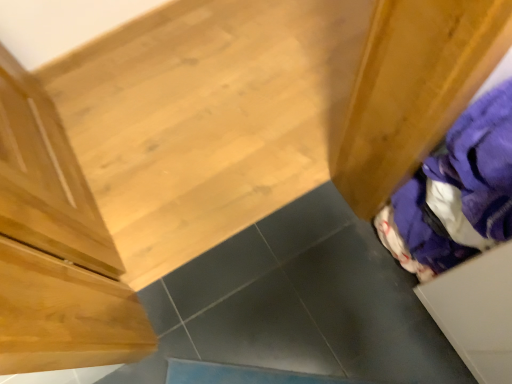
Locate an element on the screen. white matte drawer at lower right is located at coordinates (476, 312).

Describe the element at coordinates (476, 312) in the screenshot. I see `white matte drawer at lower right` at that location.

The image size is (512, 384). What do you see at coordinates (456, 193) in the screenshot? I see `purple fabric at right` at bounding box center [456, 193].

Where is `purple fabric at right`? This screenshot has width=512, height=384. purple fabric at right is located at coordinates (456, 193).

Where is `white matte drawer at lower right`? white matte drawer at lower right is located at coordinates (476, 312).

Can you confirm if purple fabric at right is positioned to the left of white matte drawer at lower right?

Yes, purple fabric at right is to the left of white matte drawer at lower right.

In the image, is purple fabric at right positioned in front of or behind white matte drawer at lower right?

purple fabric at right is positioned farther from the viewer than white matte drawer at lower right.

Considering the positions of points (438, 258) and (485, 254), is point (438, 258) closer to camera compared to point (485, 254)?

No.

Looking at this image, from the image's perspective, would you say purple fabric at right is shown under white matte drawer at lower right?

No, from the image's perspective, purple fabric at right is not below white matte drawer at lower right.

From a real-world perspective, who is located higher, purple fabric at right or white matte drawer at lower right?

purple fabric at right, from a real-world perspective.

Considering the sizes of objects purple fabric at right and white matte drawer at lower right in the image provided, who is thinner, purple fabric at right or white matte drawer at lower right?

With smaller width is purple fabric at right.

In terms of height, does purple fabric at right look taller or shorter compared to white matte drawer at lower right?

purple fabric at right is taller than white matte drawer at lower right.

Which of these two, purple fabric at right or white matte drawer at lower right, is smaller?

With smaller size is purple fabric at right.

Is white matte drawer at lower right completely or partially inside purple fabric at right?

No, white matte drawer at lower right is not inside purple fabric at right.

Are purple fabric at right and white matte drawer at lower right located far from each other?

Actually, purple fabric at right and white matte drawer at lower right are a little close together.

Is purple fabric at right facing towards white matte drawer at lower right?

No, purple fabric at right is not aimed at white matte drawer at lower right.

Can you tell me how much purple fabric at right and white matte drawer at lower right differ in facing direction?

They differ by 9.5e-05 degrees in their facing directions.

How distant is purple fabric at right from white matte drawer at lower right?

5.36 inches.

In the image, there is a purple fabric at right. At what (x,y) coordinates should I click in order to perform the action: click on drawer below it (from a real-world perspective). Please return your answer as a coordinate pair (x, y). This screenshot has width=512, height=384. Looking at the image, I should click on (476, 312).

Is white matte drawer at lower right at the right side of purple fabric at right?

Correct, you'll find white matte drawer at lower right to the right of purple fabric at right.

Which object is further away from the camera, white matte drawer at lower right or purple fabric at right?

purple fabric at right is further away from the camera.

Which is closer to the camera, (454, 333) or (485, 226)?

Point (454, 333).

From the image's perspective, is white matte drawer at lower right located above purple fabric at right?

No, from the image's perspective, white matte drawer at lower right is not over purple fabric at right.

From a real-world perspective, which is physically below, white matte drawer at lower right or purple fabric at right?

white matte drawer at lower right.

In terms of width, does white matte drawer at lower right look wider or thinner when compared to purple fabric at right?

Considering their sizes, white matte drawer at lower right looks broader than purple fabric at right.

Considering the sizes of objects white matte drawer at lower right and purple fabric at right in the image provided, who is taller, white matte drawer at lower right or purple fabric at right?

purple fabric at right is taller.

Who is smaller, white matte drawer at lower right or purple fabric at right?

Smaller between the two is purple fabric at right.

In the scene shown: Can we say white matte drawer at lower right lies outside purple fabric at right?

That's correct, white matte drawer at lower right is outside of purple fabric at right.

Can you see white matte drawer at lower right touching purple fabric at right?

white matte drawer at lower right and purple fabric at right are not in contact.

Is white matte drawer at lower right turned away from purple fabric at right?

white matte drawer at lower right is not turned away from purple fabric at right.

The width and height of the screenshot is (512, 384). In order to click on clothing above the white matte drawer at lower right (from a real-world perspective) in this screenshot , I will do `click(456, 193)`.

Find the location of a particular element. This screenshot has width=512, height=384. drawer located underneath the purple fabric at right (from a real-world perspective) is located at coordinates click(476, 312).

Identify the location of drawer that is below the purple fabric at right (from the image's perspective). (476, 312).